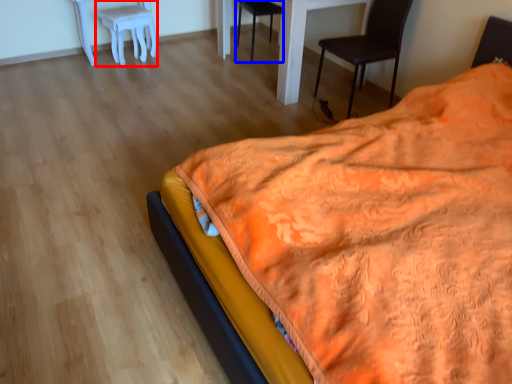
Question: Which of the following is the farthest to the observer, stool (highlighted by a red box) or chair (highlighted by a blue box)?

Choices:
 (A) stool
 (B) chair

Answer: (B)